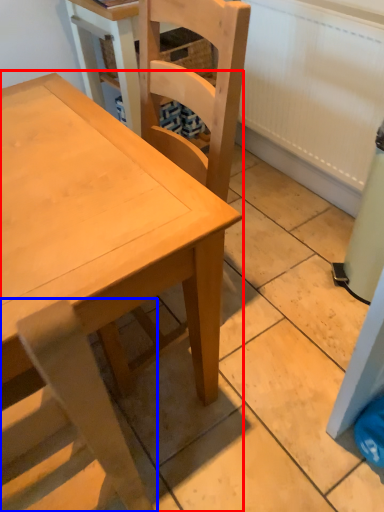
Question: Which of the following is the closest to the observer, table (highlighted by a red box) or chair (highlighted by a blue box)?

Choices:
 (A) table
 (B) chair

Answer: (B)